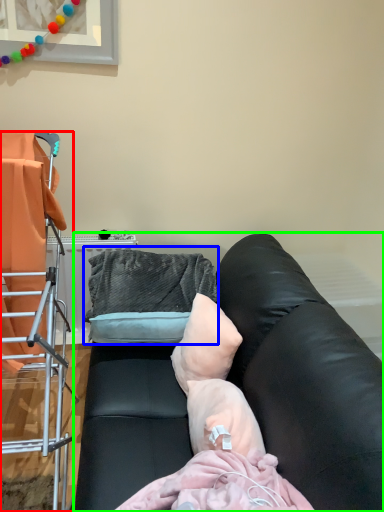
Question: Which is farther away from furniture (highlighted by a red box)? bean bag chair (highlighted by a blue box) or studio couch (highlighted by a green box)?

Choices:
 (A) bean bag chair
 (B) studio couch

Answer: (B)